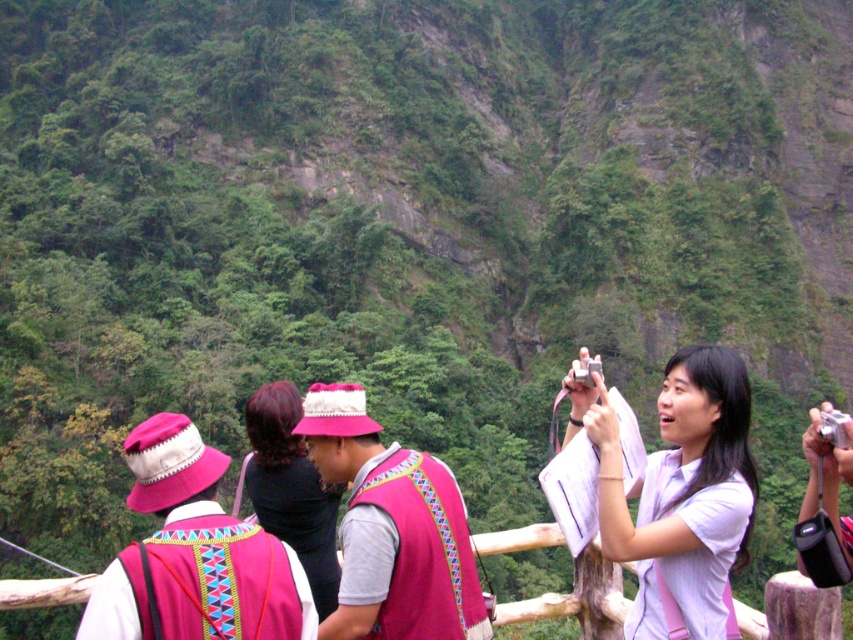
From the picture: You are standing at the viewpoint and want to locate the embroidered fabric hat at center. Which object in the scene has coordinates corresponding to point (209, 545)?

The point at coordinates (209, 545) corresponds to the embroidered fabric hat at center.

You are a photographer trying to capture the embroidered fabric hat at center and the white matte shirt at center in a single frame. Based on their positions, can you tell which object is closer to the camera?

Result: The white matte shirt at center is above the embroidered fabric hat at center, so the white matte shirt at center is closer to the camera than the embroidered fabric hat at center.

You are a photographer trying to capture a photo of the embroidered fabric hat at center and the silver metallic camera at upper right. Since you want both objects to appear equally large in the photo, which object should you move closer to, and in which direction?

The embroidered fabric hat at center has a lesser height compared to the silver metallic camera at upper right. To make them appear equally large in the photo, you should move closer to the embroidered fabric hat at center so that its image size increases relative to the larger silver metallic camera at upper right.